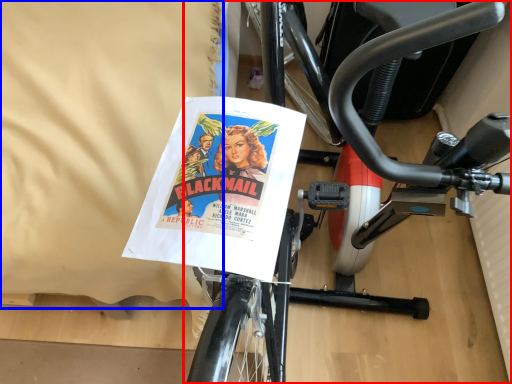
Question: Which point is closer to the camera, bicycle (highlighted by a red box) or sheet (highlighted by a blue box)?

Choices:
 (A) bicycle
 (B) sheet

Answer: (A)